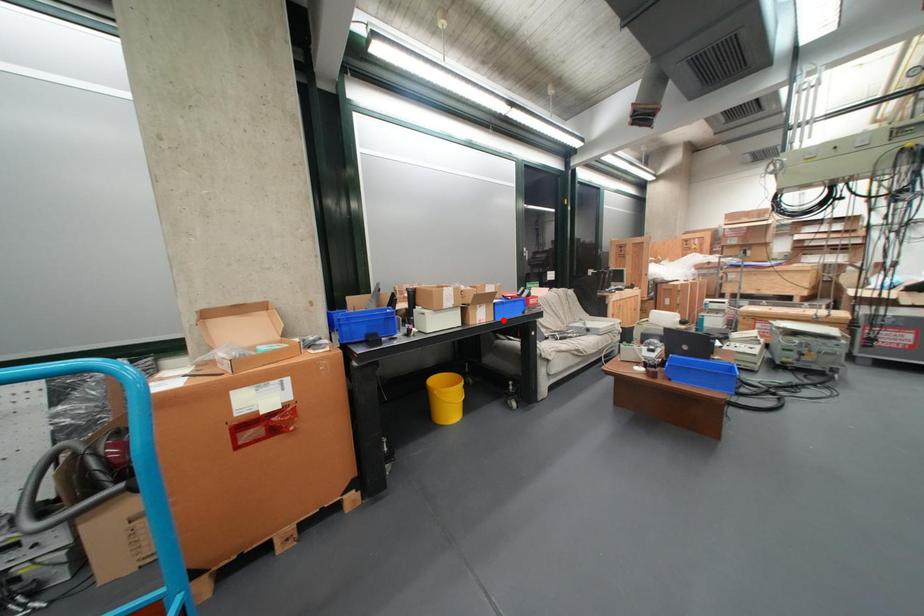
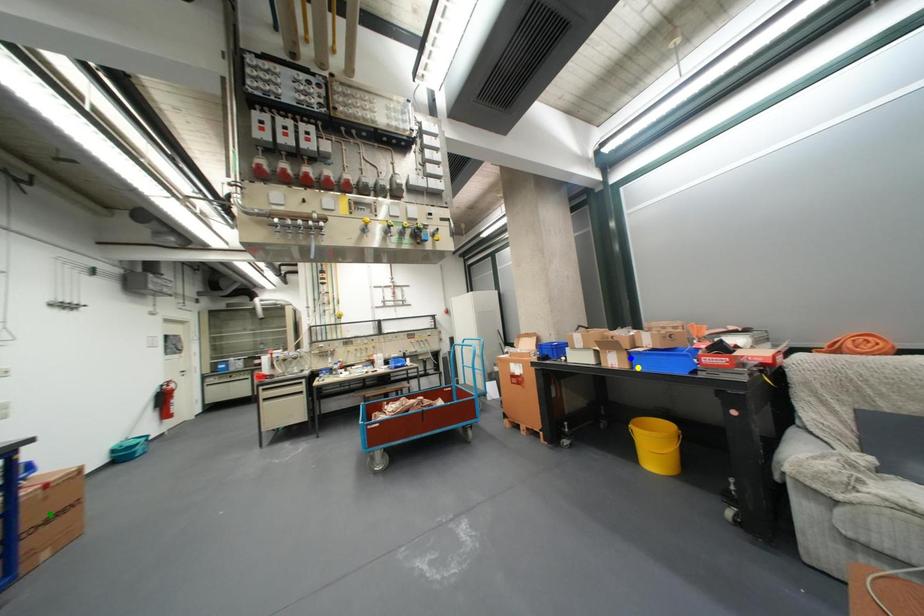
Question: I am providing you with two images of the same scene from different viewpoints. A red point is marked on the first image. You are given multiple points on the second image. In image 2, which mark is for the same physical point as the one in image 1?

Choices:
 (A) yellow point
 (B) blue point
 (C) green point

Answer: (A)